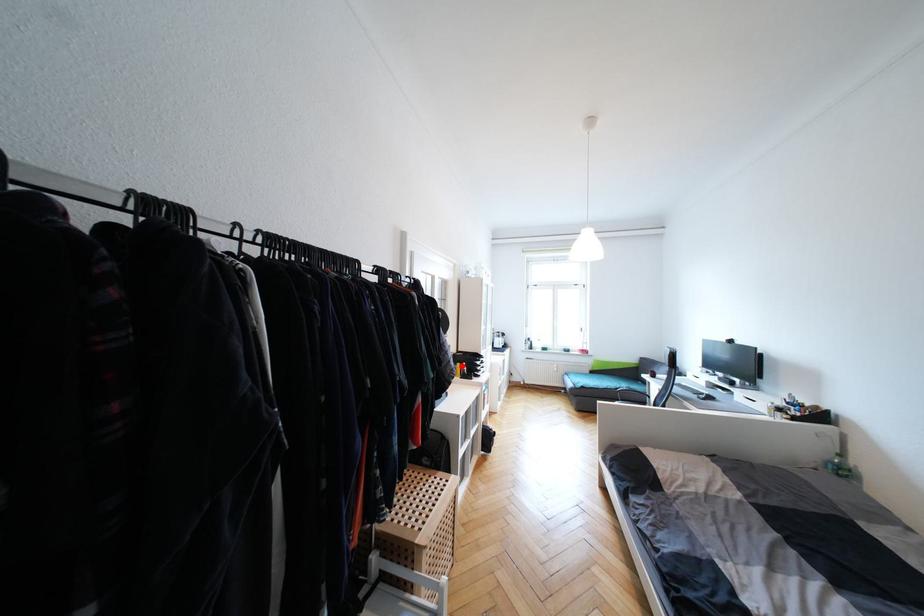
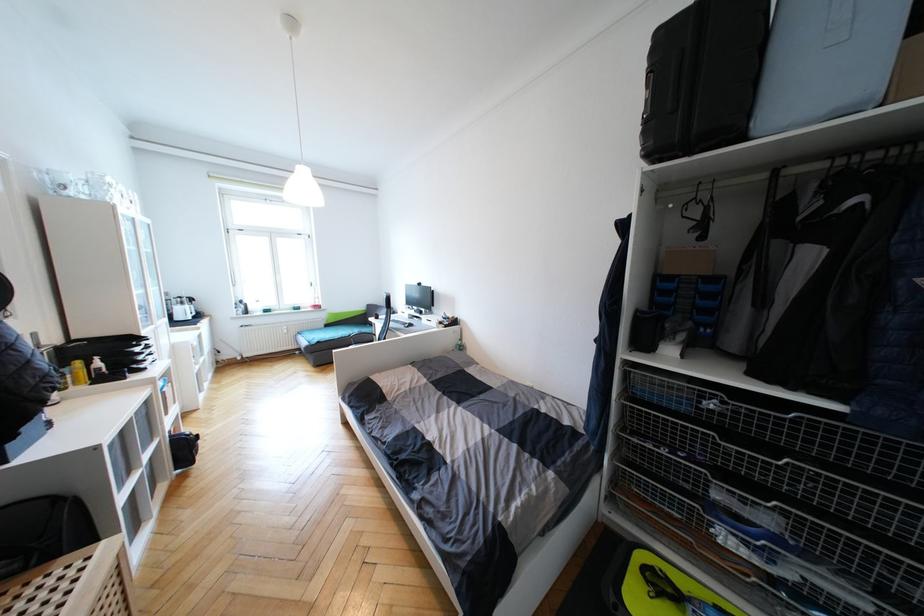
Find the pixel in the second image that matches the highlighted location in the first image.

(81, 363)